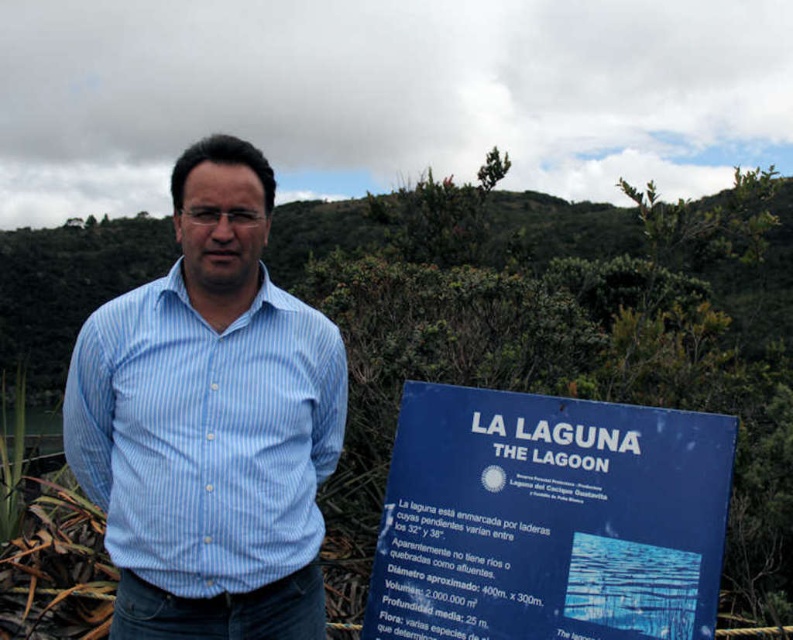
The image size is (793, 640). Describe the element at coordinates (548, 518) in the screenshot. I see `blue plastic sign at center` at that location.

Does blue plastic sign at center have a lesser height compared to blue striped shirt at center?

Correct, blue plastic sign at center is not as tall as blue striped shirt at center.

Does point (558, 630) come in front of point (79, 333)?

Yes, point (558, 630) is closer to viewer.

The width and height of the screenshot is (793, 640). In order to click on blue plastic sign at center in this screenshot , I will do `click(548, 518)`.